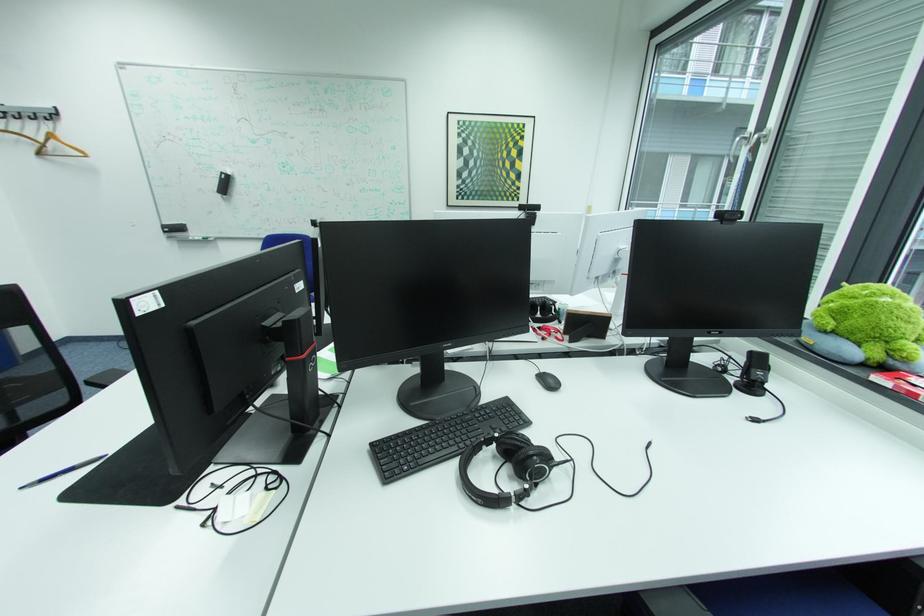
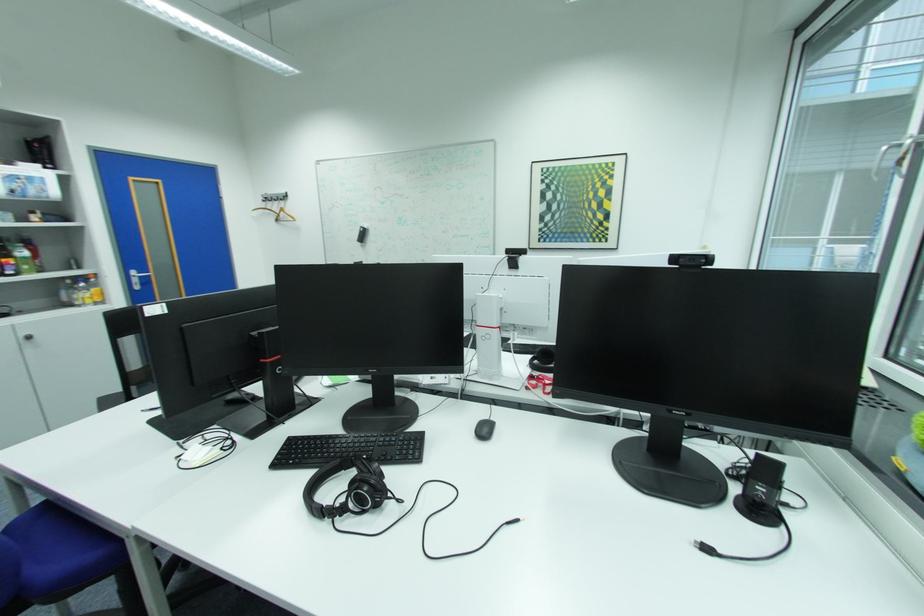
Question: The camera is either moving clockwise (left) or counter-clockwise (right) around the object. The first image is from the beginning of the video and the second image is from the end. Is the camera moving left or right when shooting the video?

Choices:
 (A) Left
 (B) Right

Answer: (B)